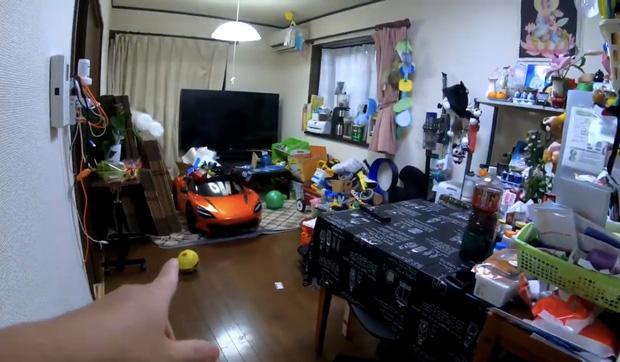
Where is `wall`? The height and width of the screenshot is (362, 620). wall is located at coordinates (23, 212).